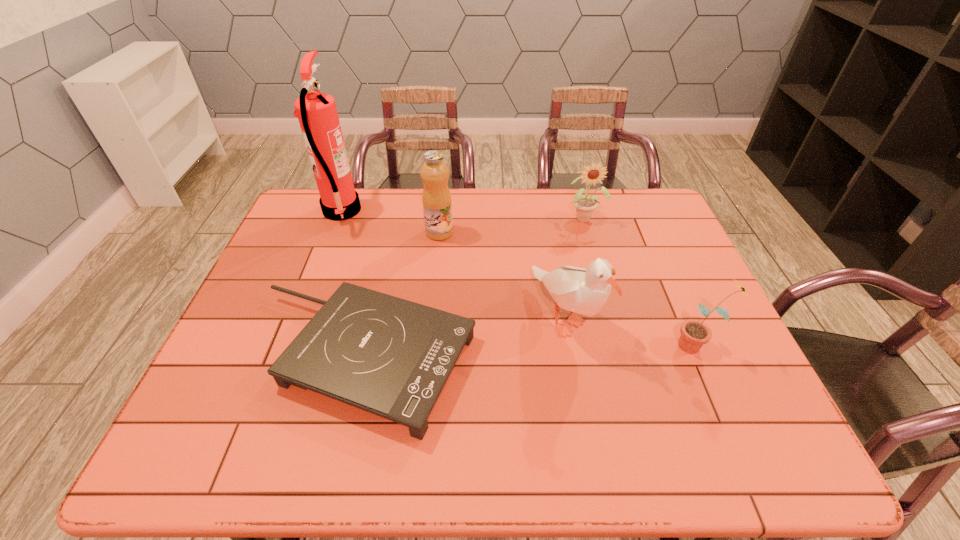
You are a GUI agent. You are given a task and a screenshot of the screen. Output one action in this format:
    pyautogui.click(x=<x>, y=<y>)
    Task: Click on the free region located on the front-facing side of the left sunflower
    The width and height of the screenshot is (960, 540).
    Given the screenshot: What is the action you would take?
    pyautogui.click(x=613, y=316)

You are a GUI agent. You are given a task and a screenshot of the screen. Output one action in this format:
    pyautogui.click(x=<x>, y=<y>)
    Task: Click on the blank area located 0.370m on the flower of the rightmost object
    
    Given the screenshot: What is the action you would take?
    pyautogui.click(x=524, y=345)

Where is `blank space located 0.310m on the flower of the rightmost object`? blank space located 0.310m on the flower of the rightmost object is located at coordinates (548, 345).

The height and width of the screenshot is (540, 960). What are the coordinates of `vacant region located 0.200m on the flower of the rightmost object` in the screenshot? It's located at (593, 345).

What are the coordinates of `free space located 0.220m on the back of the shortest object` in the screenshot? It's located at (389, 245).

What are the coordinates of `fire extinguisher at the far edge` in the screenshot? It's located at (317, 113).

Locate an element on the screen. The width and height of the screenshot is (960, 540). fruit juice at the far edge is located at coordinates (437, 206).

Identify the location of sunflower that is at the far edge. Image resolution: width=960 pixels, height=540 pixels. (585, 205).

Locate an element on the screen. The height and width of the screenshot is (540, 960). object positioned at the near edge is located at coordinates (391, 357).

At what (x,y) coordinates should I click in order to perform the action: click on fire extinguisher that is positioned at the left edge. Please return your answer as a coordinate pair (x, y). Looking at the image, I should click on (317, 113).